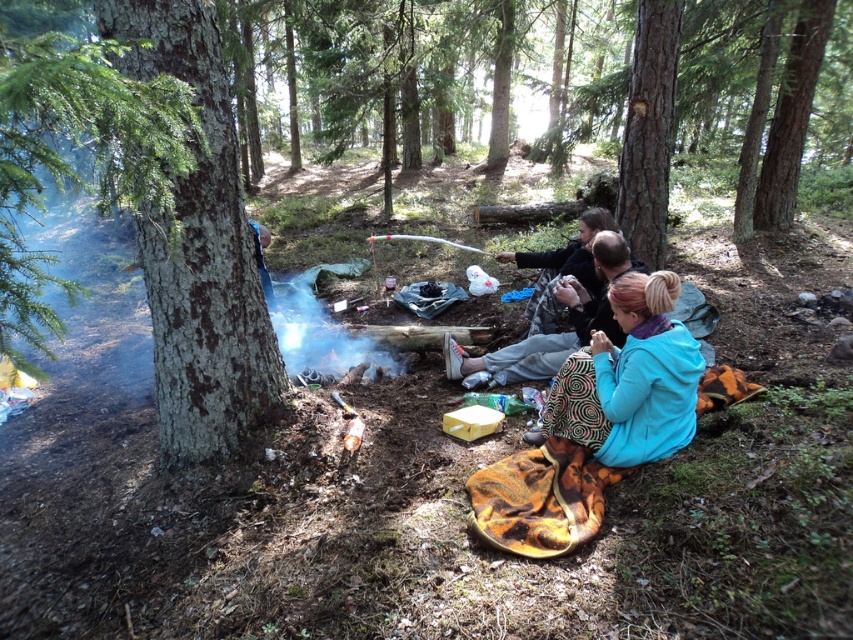
Question: Which object appears farthest from the camera in this image?

Choices:
 (A) teal fabric jacket at lower right
 (B) green rough bark tree at left

Answer: (A)

Question: Observing the image, what is the correct spatial positioning of teal fabric jacket at lower right in reference to smooth brown tree trunk at center?

Choices:
 (A) left
 (B) right

Answer: (A)

Question: Which of these objects is positioned closest to the teal fabric jacket at lower right?

Choices:
 (A) matte black jacket at center
 (B) smooth brown tree trunk at center
 (C) teal fabric jacket at center

Answer: (A)

Question: Observing the image, what is the correct spatial positioning of smooth bark tree at left in reference to teal fabric jacket at center?

Choices:
 (A) right
 (B) left

Answer: (B)

Question: Which point is closer to the camera taking this photo?

Choices:
 (A) [x=631, y=227]
 (B) [x=566, y=273]

Answer: (B)

Question: Is smooth bark tree at left to the right of teal fabric jacket at lower right from the viewer's perspective?

Choices:
 (A) no
 (B) yes

Answer: (A)